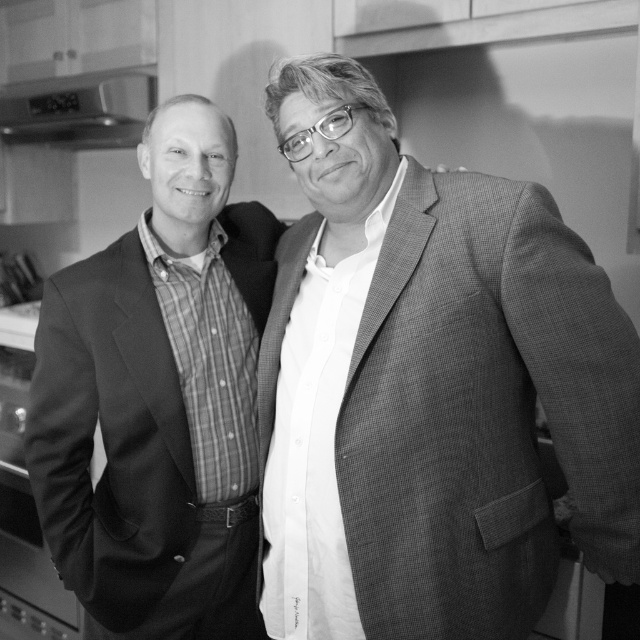
Which is below, matte black suit at left or metallic silver exhaust hood at upper left?

Positioned lower is matte black suit at left.

This screenshot has width=640, height=640. I want to click on matte black suit at left, so click(157, 397).

Locate an element on the screen. matte black suit at left is located at coordinates [157, 397].